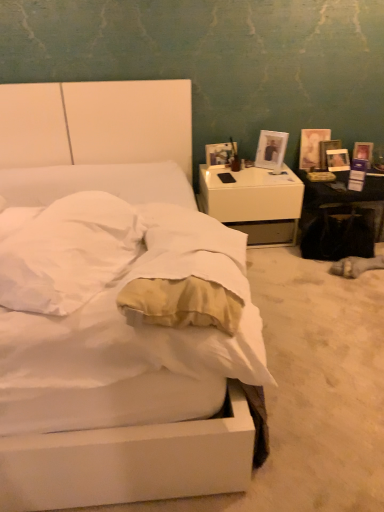
Question: From a real-world perspective, is white glossy picture frame at upper right, which appears as the first picture frame when viewed from the left, beneath white matte bed at center?

Choices:
 (A) yes
 (B) no

Answer: (B)

Question: Are white glossy picture frame at upper right, positioned as the second picture frame in right-to-left order, and white matte bed at center making contact?

Choices:
 (A) yes
 (B) no

Answer: (B)

Question: Does white glossy picture frame at upper right, positioned as the second picture frame in right-to-left order, have a greater height compared to white matte bed at center?

Choices:
 (A) yes
 (B) no

Answer: (B)

Question: Does white glossy picture frame at upper right, marked as the second picture frame in a back-to-front arrangement, turn towards white matte bed at center?

Choices:
 (A) yes
 (B) no

Answer: (A)

Question: Is white glossy picture frame at upper right, positioned as the second picture frame in right-to-left order, bigger than white matte bed at center?

Choices:
 (A) yes
 (B) no

Answer: (B)

Question: From the image's perspective, is matte white picture frame at right, the first picture frame from the right, located above or below white matte bed at center?

Choices:
 (A) below
 (B) above

Answer: (B)

Question: In terms of width, does matte white picture frame at right, acting as the second picture frame starting from the front, look wider or thinner when compared to white matte bed at center?

Choices:
 (A) thin
 (B) wide

Answer: (A)

Question: Relative to white matte bed at center, is matte white picture frame at right, which is the first picture frame in back-to-front order, in front or behind?

Choices:
 (A) behind
 (B) front

Answer: (A)

Question: Is point (337, 164) positioned closer to the camera than point (59, 144)?

Choices:
 (A) farther
 (B) closer

Answer: (A)

Question: Visually, is white soft mattress at center positioned to the left or to the right of white glossy table at right?

Choices:
 (A) left
 (B) right

Answer: (A)

Question: Is point (81, 280) closer or farther from the camera than point (329, 202)?

Choices:
 (A) closer
 (B) farther

Answer: (A)

Question: From a real-world perspective, is white soft mattress at center above or below white glossy table at right?

Choices:
 (A) above
 (B) below

Answer: (A)

Question: In terms of width, does white soft mattress at center look wider or thinner when compared to white glossy table at right?

Choices:
 (A) thin
 (B) wide

Answer: (A)

Question: From the image's perspective, is matte white picture frame at right, acting as the second picture frame starting from the front, above or below white glossy table at right?

Choices:
 (A) above
 (B) below

Answer: (A)

Question: Visually, is matte white picture frame at right, the first picture frame from the right, positioned to the left or to the right of white glossy table at right?

Choices:
 (A) right
 (B) left

Answer: (B)